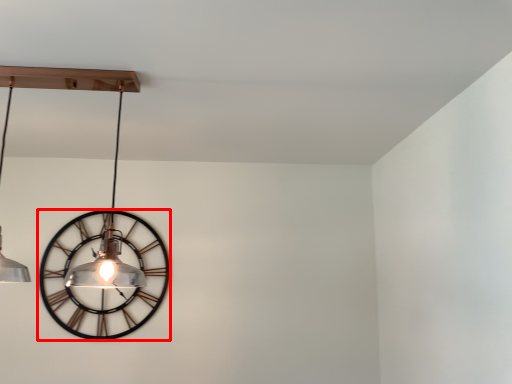
Question: Observing the image, what is the correct spatial positioning of wall clock (annotated by the red box) in reference to lamp?

Choices:
 (A) left
 (B) right

Answer: (A)